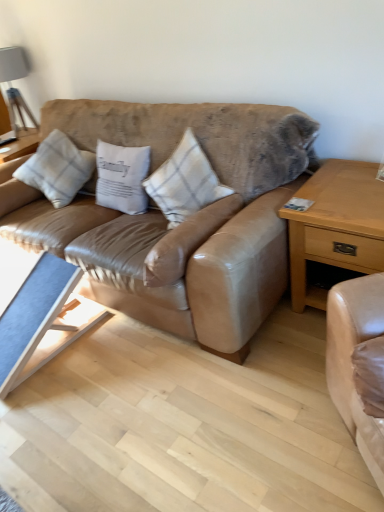
Describe the element at coordinates (336, 226) in the screenshot. I see `light brown wood nightstand at right` at that location.

Image resolution: width=384 pixels, height=512 pixels. Identify the location of blue fabric coffee table at lower left. (38, 312).

The height and width of the screenshot is (512, 384). What do you see at coordinates (122, 177) in the screenshot? I see `white cotton pillow at center, which is counted as the second pillow, starting from the right` at bounding box center [122, 177].

What do you see at coordinates (181, 224) in the screenshot? I see `leather couch at center` at bounding box center [181, 224].

Identify the location of light brown wood nightstand at right. (336, 226).

Does blue fabric coffee table at lower left have a lesser height compared to light brown wood nightstand at right?

Yes.

Is blue fabric coffee table at lower left aimed at light brown wood nightstand at right?

No, blue fabric coffee table at lower left is not facing towards light brown wood nightstand at right.

Is point (78, 306) positioned after point (372, 221)?

Yes, point (78, 306) is farther from viewer.

Can you confirm if blue fabric coffee table at lower left is positioned to the left of light brown wood nightstand at right?

Yes.

Can you confirm if white plaid pillow at center, the first pillow in the left-to-right sequence, is thinner than light brown wood nightstand at right?

Indeed, white plaid pillow at center, the first pillow in the left-to-right sequence, has a lesser width compared to light brown wood nightstand at right.

Which object is further away from the camera, white plaid pillow at center, the first pillow in the left-to-right sequence, or light brown wood nightstand at right?

white plaid pillow at center, the first pillow in the left-to-right sequence, is further from the camera.

Is white plaid pillow at center, the first pillow in the left-to-right sequence, looking in the opposite direction of light brown wood nightstand at right?

white plaid pillow at center, the first pillow in the left-to-right sequence, is not turned away from light brown wood nightstand at right.

From a real-world perspective, is white plaid pillow at center, which is counted as the 3th pillow, starting from the right, physically above light brown wood nightstand at right?

Yes, from a real-world perspective, white plaid pillow at center, which is counted as the 3th pillow, starting from the right, is over light brown wood nightstand at right

In the image, there is a leather couch at center. What are the coordinates of `coffee table below it (from the image's perspective)` in the screenshot? It's located at (38, 312).

Is blue fabric coffee table at lower left oriented away from leather couch at center?

That's right, blue fabric coffee table at lower left is facing away from leather couch at center.

Does point (23, 272) lie in front of point (230, 170)?

No.

In terms of size, does blue fabric coffee table at lower left appear bigger or smaller than leather couch at center?

In the image, blue fabric coffee table at lower left appears to be smaller than leather couch at center.

The image size is (384, 512). In order to click on nightstand in front of the white cotton pillow at center, which ranks as the 3th pillow in left-to-right order in this screenshot , I will do `click(336, 226)`.

From a real-world perspective, is white cotton pillow at center, which ranks as the 3th pillow in left-to-right order, on top of light brown wood nightstand at right?

Yes, from a real-world perspective, white cotton pillow at center, which ranks as the 3th pillow in left-to-right order, is on top of light brown wood nightstand at right.

Is white cotton pillow at center, positioned as the 1th pillow in right-to-left order, in front of or behind light brown wood nightstand at right in the image?

white cotton pillow at center, positioned as the 1th pillow in right-to-left order, is positioned farther from the viewer than light brown wood nightstand at right.

From the image's perspective, which is below, white cotton pillow at center, which ranks as the 3th pillow in left-to-right order, or light brown wood nightstand at right?

From the image's view, light brown wood nightstand at right is below.

Which object is more forward, light brown wood nightstand at right or white plaid pillow at center, which is counted as the 3th pillow, starting from the right?

light brown wood nightstand at right is more forward.

From a real-world perspective, is light brown wood nightstand at right positioned under white plaid pillow at center, the first pillow in the left-to-right sequence, based on gravity?

Correct, in the physical world, light brown wood nightstand at right is lower than white plaid pillow at center, the first pillow in the left-to-right sequence.

From the picture: Is light brown wood nightstand at right to the right of white plaid pillow at center, which is counted as the 3th pillow, starting from the right, from the viewer's perspective?

Correct, you'll find light brown wood nightstand at right to the right of white plaid pillow at center, which is counted as the 3th pillow, starting from the right.

Which is correct: leather couch at center is inside white cotton pillow at center, the 2th pillow from the left, or outside of it?

leather couch at center cannot be found inside white cotton pillow at center, the 2th pillow from the left.

How many degrees apart are the facing directions of leather couch at center and white cotton pillow at center, which is counted as the second pillow, starting from the right?

The facing directions of leather couch at center and white cotton pillow at center, which is counted as the second pillow, starting from the right, are 4.47 degrees apart.

From the picture: Is leather couch at center wider or thinner than white cotton pillow at center, the 2th pillow from the left?

Considering their sizes, leather couch at center looks broader than white cotton pillow at center, the 2th pillow from the left.

Looking at this image, is leather couch at center turned away from white cotton pillow at center, the 2th pillow from the left?

Yes, white cotton pillow at center, the 2th pillow from the left, is at the back of leather couch at center.

Which is more to the left, light brown wood nightstand at right or blue fabric coffee table at lower left?

From the viewer's perspective, blue fabric coffee table at lower left appears more on the left side.

From a real-world perspective, is light brown wood nightstand at right above or below blue fabric coffee table at lower left?

Clearly, from a real-world perspective, light brown wood nightstand at right is above blue fabric coffee table at lower left.

Is light brown wood nightstand at right in front of blue fabric coffee table at lower left?

Yes, light brown wood nightstand at right is closer to the viewer.

In the image, there is a light brown wood nightstand at right. What are the coordinates of `coffee table below it (from a real-world perspective)` in the screenshot? It's located at [x=38, y=312].

Where is `nightstand that appears in front of the white plaid pillow at center, which is counted as the 3th pillow, starting from the right`? This screenshot has width=384, height=512. nightstand that appears in front of the white plaid pillow at center, which is counted as the 3th pillow, starting from the right is located at coordinates (336, 226).

Considering their positions, is white cotton pillow at center, which is counted as the second pillow, starting from the right, positioned closer to leather couch at center than white cotton pillow at center, which ranks as the 3th pillow in left-to-right order?

Among the two, white cotton pillow at center, which ranks as the 3th pillow in left-to-right order, is located nearer to leather couch at center.

When comparing their distances from white cotton pillow at center, which is counted as the second pillow, starting from the right, does white plaid pillow at center, the first pillow in the left-to-right sequence, or blue fabric coffee table at lower left seem closer?

white plaid pillow at center, the first pillow in the left-to-right sequence, is closer to white cotton pillow at center, which is counted as the second pillow, starting from the right.

Based on their spatial positions, is white cotton pillow at center, which ranks as the 3th pillow in left-to-right order, or light brown wood nightstand at right further from leather couch at center?

Based on the image, light brown wood nightstand at right appears to be further to leather couch at center.

Based on their spatial positions, is light brown wood nightstand at right or leather couch at center further from white plaid pillow at center, the first pillow in the left-to-right sequence?

Among the two, light brown wood nightstand at right is located further to white plaid pillow at center, the first pillow in the left-to-right sequence.

From the image, which object appears to be farther from leather couch at center, white cotton pillow at center, which ranks as the 3th pillow in left-to-right order, or blue fabric coffee table at lower left?

Based on the image, blue fabric coffee table at lower left appears to be further to leather couch at center.

Which object lies nearer to the anchor point leather couch at center, white plaid pillow at center, the first pillow in the left-to-right sequence, or white cotton pillow at center, which is counted as the second pillow, starting from the right?

Among the two, white cotton pillow at center, which is counted as the second pillow, starting from the right, is located nearer to leather couch at center.

Considering their positions, is leather couch at center positioned closer to matte gray lampshade at upper left than white cotton pillow at center, which is counted as the second pillow, starting from the right?

white cotton pillow at center, which is counted as the second pillow, starting from the right.

When comparing their distances from white plaid pillow at center, which is counted as the 3th pillow, starting from the right, does white cotton pillow at center, the 2th pillow from the left, or leather couch at center seem closer?

Based on the image, white cotton pillow at center, the 2th pillow from the left, appears to be nearer to white plaid pillow at center, which is counted as the 3th pillow, starting from the right.

At what (x,y) coordinates should I click in order to perform the action: click on coffee table between leather couch at center and matte gray lampshade at upper left in the front-back direction. Please return your answer as a coordinate pair (x, y). This screenshot has width=384, height=512. Looking at the image, I should click on (38, 312).

This screenshot has width=384, height=512. In order to click on pillow between matte gray lampshade at upper left and white cotton pillow at center, which is counted as the second pillow, starting from the right, from left to right in this screenshot , I will do `click(57, 169)`.

This screenshot has height=512, width=384. Identify the location of coffee table between leather couch at center and white plaid pillow at center, which is counted as the 3th pillow, starting from the right, in the front-back direction. (38, 312).

Locate an element on the screen. The width and height of the screenshot is (384, 512). pillow between white cotton pillow at center, which is counted as the second pillow, starting from the right, and blue fabric coffee table at lower left vertically is located at coordinates (185, 182).